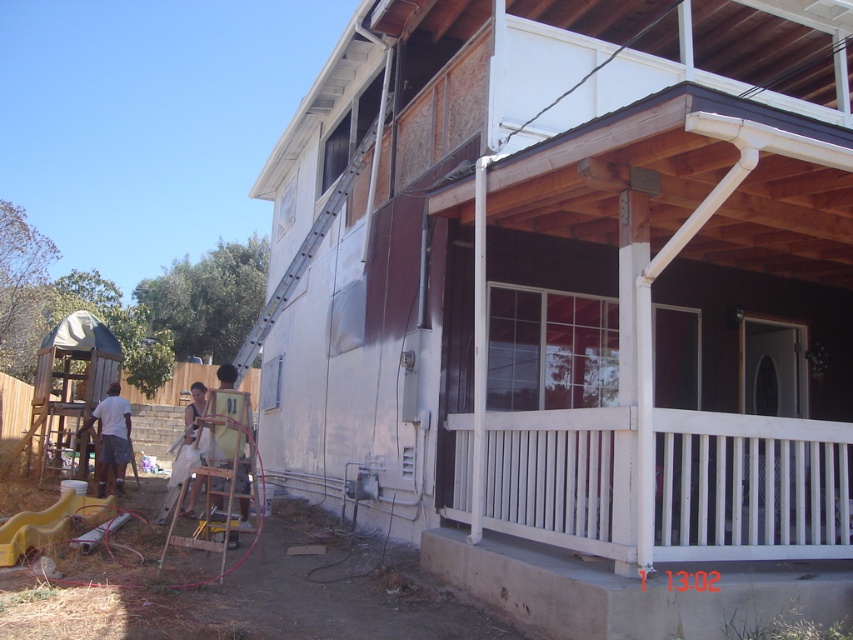
Question: Can you confirm if white wooden porch at center is positioned below white cotton shirt at left?

Choices:
 (A) no
 (B) yes

Answer: (A)

Question: Which point is closer to the camera?

Choices:
 (A) (218, 372)
 (B) (833, 470)

Answer: (B)

Question: Which object is closer to the camera taking this photo?

Choices:
 (A) white wooden porch at center
 (B) white cotton shirt at left

Answer: (A)

Question: Can you confirm if white wooden porch at center is bigger than white cotton shirt at left?

Choices:
 (A) yes
 (B) no

Answer: (B)

Question: Which object is positioned farthest from the yellow fabric shirt at center?

Choices:
 (A) white wooden porch at center
 (B) white cotton shirt at left

Answer: (A)

Question: Can you confirm if white cotton shirt at left is positioned above yellow fabric shirt at center?

Choices:
 (A) yes
 (B) no

Answer: (B)